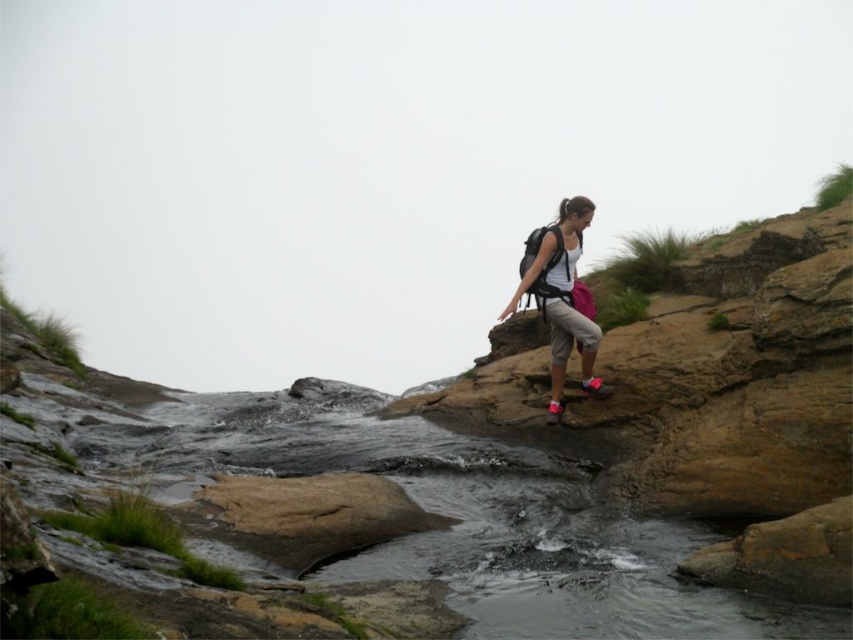
Question: Can you confirm if clear water at center is positioned above white fabric backpack at center-right?

Choices:
 (A) yes
 (B) no

Answer: (B)

Question: Is white fabric backpack at center-right to the left of matte black backpack at upper right from the viewer's perspective?

Choices:
 (A) no
 (B) yes

Answer: (A)

Question: Observing the image, what is the correct spatial positioning of clear water at center in reference to matte black backpack at upper right?

Choices:
 (A) below
 (B) above

Answer: (A)

Question: Based on their relative distances, which object is farther from the matte black backpack at upper right?

Choices:
 (A) clear water at center
 (B) white fabric backpack at center-right

Answer: (A)

Question: Which point is closer to the camera taking this photo?

Choices:
 (A) (529, 250)
 (B) (467, 442)
 (C) (558, 208)

Answer: (A)

Question: Among these objects, which one is farthest from the camera?

Choices:
 (A) matte black backpack at upper right
 (B) white fabric backpack at center-right
 (C) clear water at center

Answer: (A)